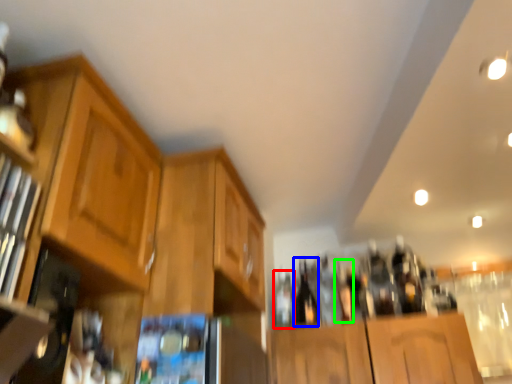
Question: Estimate the real-world distances between objects in this image. Which object is closer to bottle (highlighted by a red box), beer bottle (highlighted by a blue box) or bottle (highlighted by a green box)?

Choices:
 (A) beer bottle
 (B) bottle

Answer: (A)